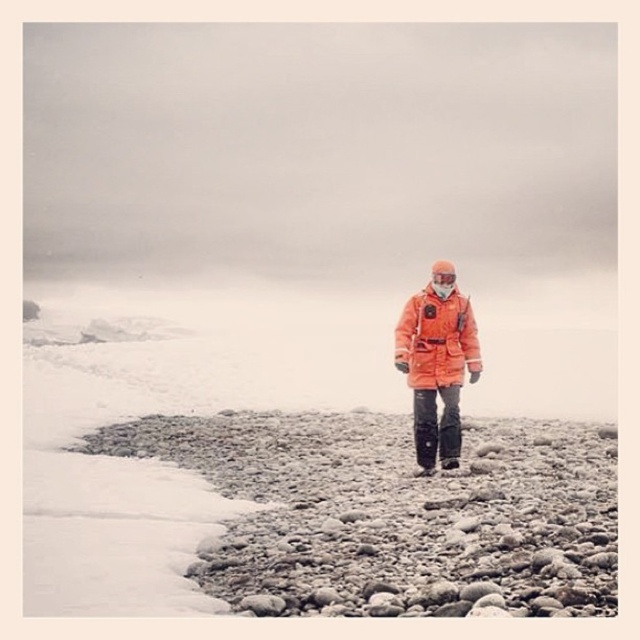
Consider the image. You are a photographer trying to capture the orange matte jacket at center and the white matte snow at center in the same frame. Which object should you adjust your camera to focus on first if you want to include both in your shot?

The white matte snow at center is positioned on the left side of orange matte jacket at center, so you should focus on the orange matte jacket at center first to ensure both objects are in frame.

You are a photographer standing on the beach and want to capture both the white matte snow at center and the orange matte jacket at center in the same frame. The camera has a maximum focus range of 4 meters. Can you fit both objects in the frame without moving?

The white matte snow at center and orange matte jacket at center are 4.41 meters apart from each other. Since the camera can only focus up to 4 meters, the distance between them exceeds the maximum range. Therefore, you cannot fit both objects in the frame without moving.